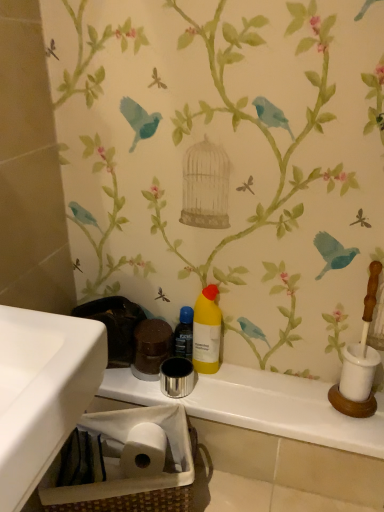
Where is `free space above metallic silver cup at center (from a real-world perspective)`? Image resolution: width=384 pixels, height=512 pixels. free space above metallic silver cup at center (from a real-world perspective) is located at coordinates 253,388.